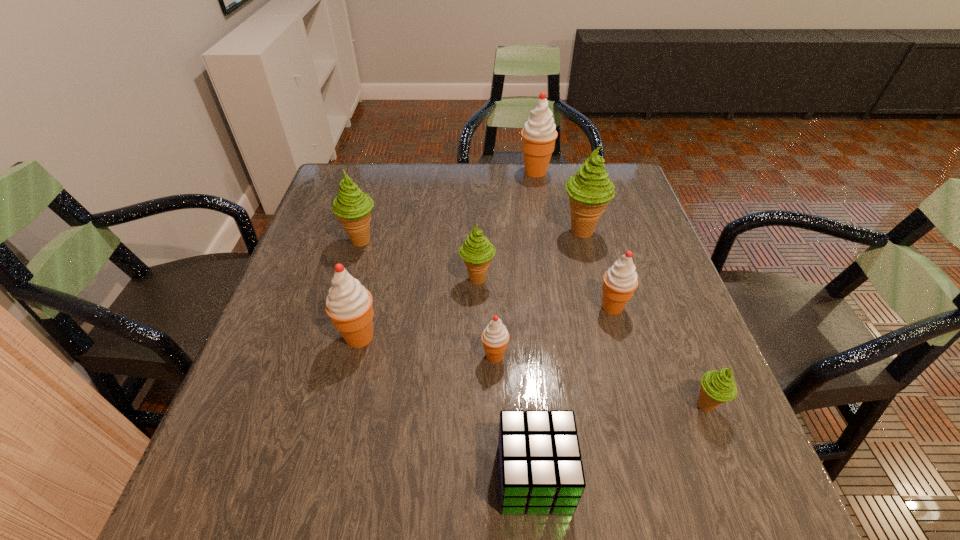
Identify the location of the rightmost object. (717, 386).

Where is `the smallest green icecream`? The width and height of the screenshot is (960, 540). the smallest green icecream is located at coordinates (717, 386).

Find the location of `red cube`. red cube is located at coordinates (540, 469).

Identify the location of cube. This screenshot has height=540, width=960. (540, 469).

The image size is (960, 540). What are the coordinates of `vacant space located 0.130m on the right of the third red icecream from left to right` in the screenshot? It's located at (594, 172).

I want to click on free space located on the left of the second green icecream from right to left, so click(x=540, y=232).

This screenshot has width=960, height=540. I want to click on vacant region located 0.130m on the front of the third smallest green icecream, so click(347, 293).

Find the location of a particular element. free space located on the back of the second biggest red icecream is located at coordinates (372, 284).

Where is `vacant space located 0.160m on the back of the second farthest red icecream`? Image resolution: width=960 pixels, height=540 pixels. vacant space located 0.160m on the back of the second farthest red icecream is located at coordinates (596, 249).

Where is `vacant area situated 0.080m on the back of the fourth farthest icecream`? vacant area situated 0.080m on the back of the fourth farthest icecream is located at coordinates (477, 247).